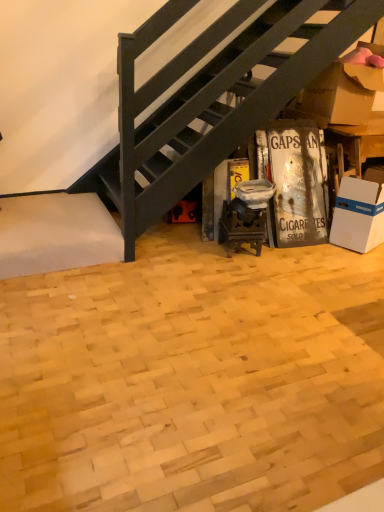
Question: Can you confirm if natural wood parquet floor at center is wider than white cardboard box at lower right?

Choices:
 (A) yes
 (B) no

Answer: (A)

Question: Is the position of natural wood parquet floor at center more distant than that of white cardboard box at lower right?

Choices:
 (A) yes
 (B) no

Answer: (B)

Question: Can you confirm if natural wood parquet floor at center is smaller than white cardboard box at lower right?

Choices:
 (A) yes
 (B) no

Answer: (B)

Question: Can you confirm if natural wood parquet floor at center is shorter than white cardboard box at lower right?

Choices:
 (A) yes
 (B) no

Answer: (A)

Question: Is natural wood parquet floor at center bigger than white cardboard box at lower right?

Choices:
 (A) no
 (B) yes

Answer: (B)

Question: From a real-world perspective, is white cardboard box at lower right positioned above or below natural wood parquet floor at center?

Choices:
 (A) below
 (B) above

Answer: (B)

Question: Would you say white cardboard box at lower right is to the left or to the right of natural wood parquet floor at center in the picture?

Choices:
 (A) left
 (B) right

Answer: (B)

Question: Based on their sizes in the image, would you say white cardboard box at lower right is bigger or smaller than natural wood parquet floor at center?

Choices:
 (A) big
 (B) small

Answer: (B)

Question: In terms of height, does white cardboard box at lower right look taller or shorter compared to natural wood parquet floor at center?

Choices:
 (A) short
 (B) tall

Answer: (B)

Question: In the image, is natural wood parquet floor at center positioned in front of or behind brown cardboard box at upper right?

Choices:
 (A) behind
 (B) front

Answer: (B)

Question: Is natural wood parquet floor at center to the left or to the right of brown cardboard box at upper right in the image?

Choices:
 (A) left
 (B) right

Answer: (A)

Question: From a real-world perspective, relative to brown cardboard box at upper right, is natural wood parquet floor at center vertically above or below?

Choices:
 (A) above
 (B) below

Answer: (B)

Question: Does point (165, 415) appear closer or farther from the camera than point (334, 84)?

Choices:
 (A) closer
 (B) farther

Answer: (A)

Question: From a real-world perspective, relative to natural wood parquet floor at center, is brown cardboard box at upper right vertically above or below?

Choices:
 (A) below
 (B) above

Answer: (B)

Question: Visually, is brown cardboard box at upper right positioned to the left or to the right of natural wood parquet floor at center?

Choices:
 (A) right
 (B) left

Answer: (A)